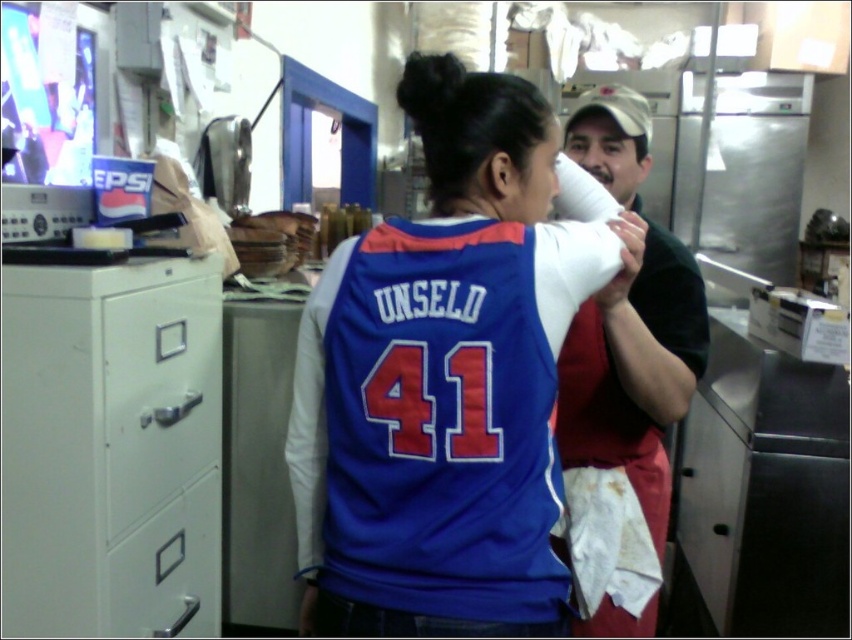
You are organizing a small office space and need to decide where to place a new tall printer. The metallic gray file cabinet at left and the metallic gray drawer at lower left are both candidates. Which object should you place the printer on top of, considering their heights?

The metallic gray file cabinet at left is much taller than the metallic gray drawer at lower left, so the printer should be placed on top of the metallic gray file cabinet at left since it has a higher surface.